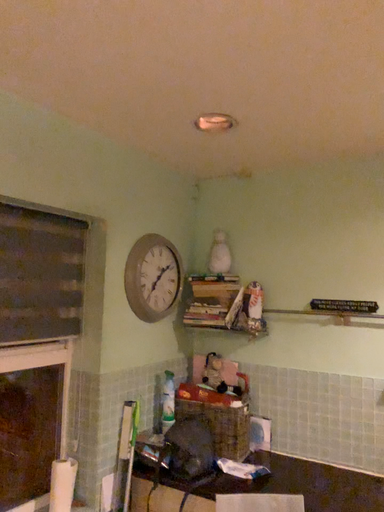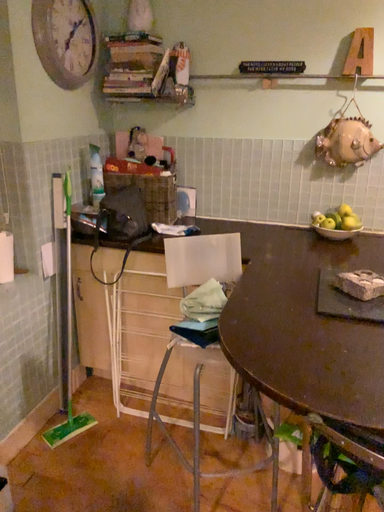
Question: Which way did the camera rotate in the video?

Choices:
 (A) rotated upward
 (B) rotated downward

Answer: (B)